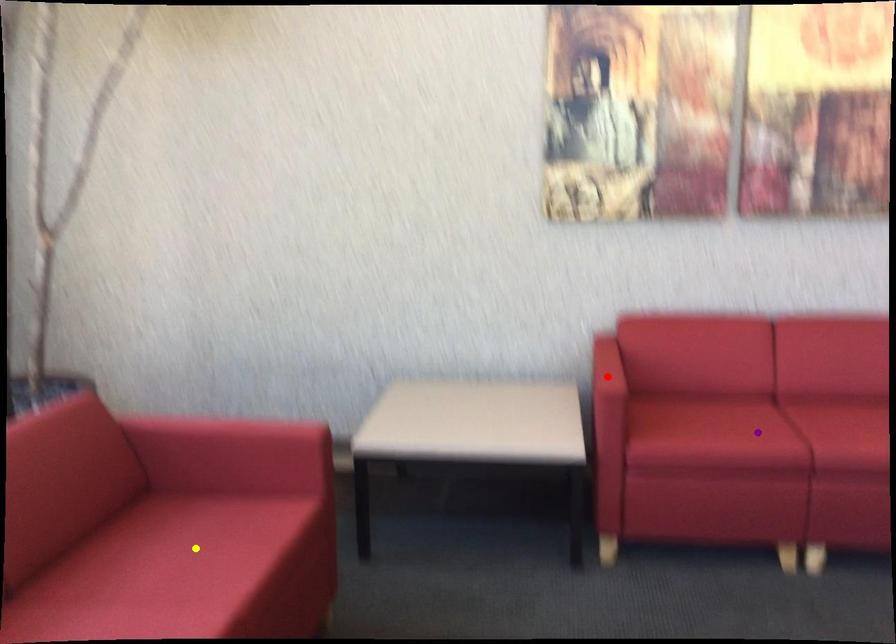
Order these from farthest to nearest:
red point
purple point
yellow point

red point < purple point < yellow point